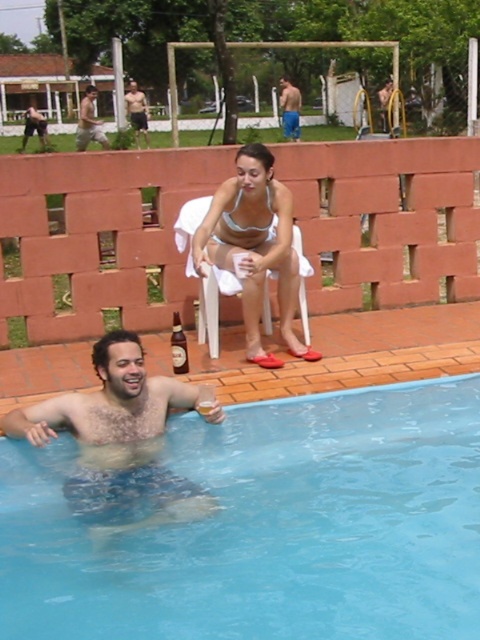
Measure the distance between blue smooth water at lower left and blue denim shorts at upper center.

blue smooth water at lower left is 18.79 meters away from blue denim shorts at upper center.

Between blue smooth water at lower left and blue denim shorts at upper center, which one has less height?

Standing shorter between the two is blue denim shorts at upper center.

This screenshot has width=480, height=640. Describe the element at coordinates (268, 528) in the screenshot. I see `blue smooth water at lower left` at that location.

Locate an element on the screen. blue smooth water at lower left is located at coordinates (268, 528).

Is blue smooth water at lower left thinner than white mesh bikini top at upper center?

In fact, blue smooth water at lower left might be wider than white mesh bikini top at upper center.

What do you see at coordinates (268, 528) in the screenshot?
I see `blue smooth water at lower left` at bounding box center [268, 528].

Is point (380, 458) positioned before point (248, 227)?

Yes, it is in front of point (248, 227).

This screenshot has width=480, height=640. I want to click on blue smooth water at lower left, so click(268, 528).

Based on the photo, is brown glass bottle at lower left positioned behind clear plastic cup at upper right?

That is True.

This screenshot has width=480, height=640. I want to click on brown glass bottle at lower left, so click(x=179, y=346).